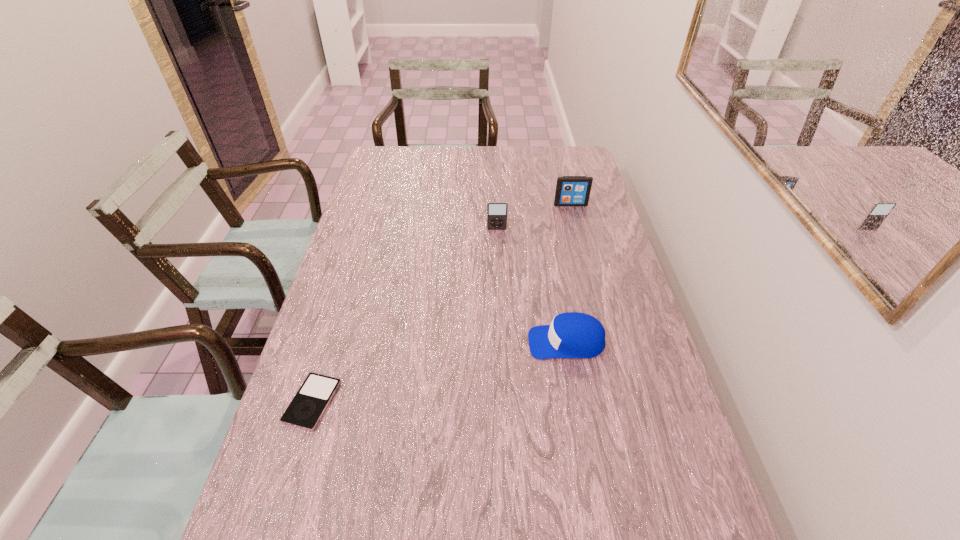
Locate an element on the screen. The width and height of the screenshot is (960, 540). vacant space at the far left corner of the desktop is located at coordinates (405, 156).

At what (x,y) coordinates should I click in order to perform the action: click on empty space between the leftmost object and the rightmost iPod. Please return your answer as a coordinate pair (x, y). Image resolution: width=960 pixels, height=540 pixels. Looking at the image, I should click on (442, 303).

Locate an element on the screen. The image size is (960, 540). unoccupied position between the farthest object and the second iPod from left to right is located at coordinates click(x=534, y=217).

This screenshot has height=540, width=960. Identify the location of vacant area between the leftmost object and the second iPod from right to left. (405, 316).

Locate an element on the screen. The width and height of the screenshot is (960, 540). vacant area between the second nearest object and the farthest object is located at coordinates (568, 273).

The height and width of the screenshot is (540, 960). In order to click on free space between the second iPod from right to left and the second shortest object in this screenshot , I will do `click(532, 286)`.

Identify the location of free space between the farthest object and the third farthest object. (x=568, y=273).

Identify the location of free space between the third tallest object and the rightmost iPod. (568, 273).

Find the location of `blank region between the shortest object and the third farthest object`. blank region between the shortest object and the third farthest object is located at coordinates (440, 372).

Identify the location of vacant space in between the third nearest object and the third tallest object. (532, 286).